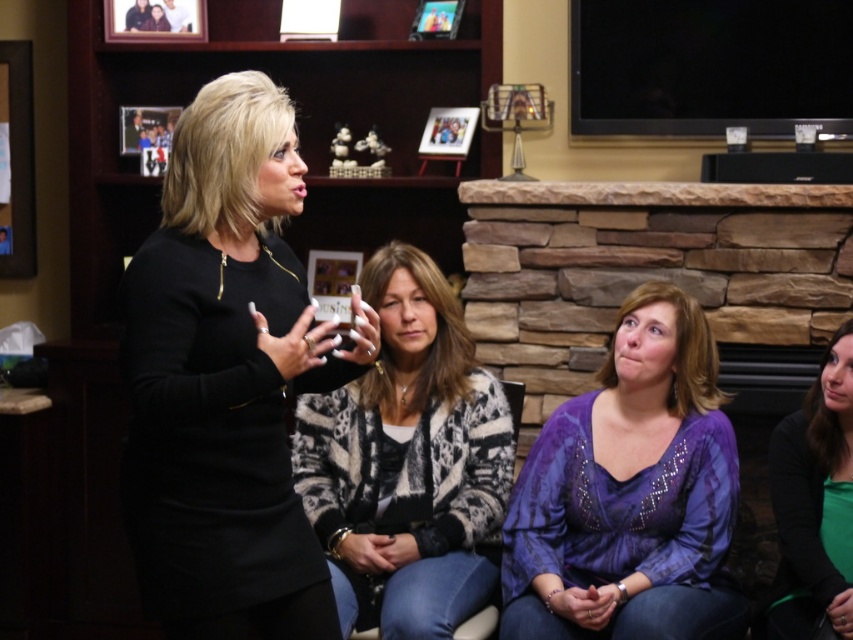
Question: Based on their relative distances, which object is nearer to the purple sequined blouse at center?

Choices:
 (A) wooden picture frame at upper center
 (B) wooden photo frame at upper left

Answer: (A)

Question: Among these objects, which one is farthest from the camera?

Choices:
 (A) wooden picture frame at upper center
 (B) green matte shirt at lower right

Answer: (A)

Question: Among these objects, which one is farthest from the camera?

Choices:
 (A) purple sequined blouse at center
 (B) printed fabric cardigan at center
 (C) black matte dress at center
 (D) wooden picture frame at upper center

Answer: (D)

Question: Can you confirm if purple sequined blouse at center is positioned above wooden photo frame at upper left?

Choices:
 (A) no
 (B) yes

Answer: (A)

Question: Is black matte dress at center bigger than purple sequined blouse at center?

Choices:
 (A) no
 (B) yes

Answer: (A)

Question: Can you confirm if black matte dress at center is positioned above printed fabric cardigan at center?

Choices:
 (A) yes
 (B) no

Answer: (A)